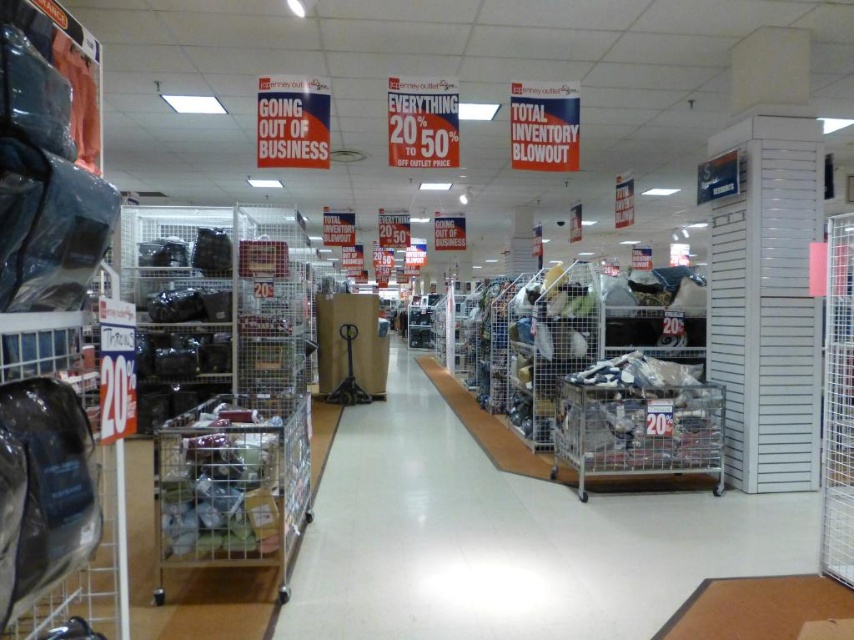
You are a customer in the JCPenney Outlet store and need to decide between using the metal mesh cart at center or the metallic silver shopping cart at center. Which cart has a larger width?

The metal mesh cart at center has a larger width than the metallic silver shopping cart at center according to the description.

You are a customer in the JCPenney Outlet store and notice two metallic silver carts. One is the metallic silver shopping cart at center and the other is the metallic silver cart at center. Which one is closer to you?

The metallic silver shopping cart at center is closer to you than the metallic silver cart at center.

You are a customer in the JCPenney Outlet store and need to reach the items on the top shelf. You see a metal mesh cart at center and a metallic silver cart at center. Which cart is taller and can help you reach higher?

The metallic silver cart at center is taller than the metal mesh cart at center, so it can help you reach higher.